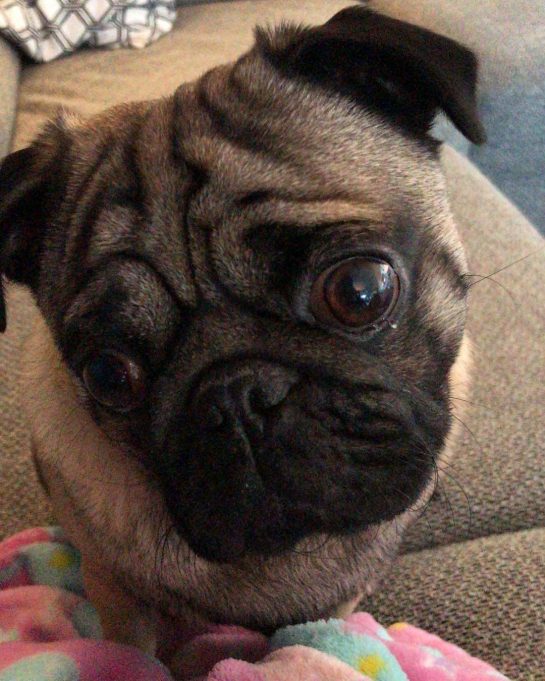
Locate an element on the screen. The width and height of the screenshot is (545, 681). blanket is located at coordinates (353, 661).